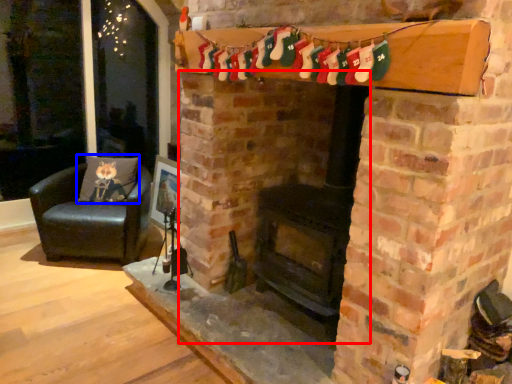
Question: Which of the following is the closest to the observer, fireplace (highlighted by a red box) or pillow (highlighted by a blue box)?

Choices:
 (A) fireplace
 (B) pillow

Answer: (A)